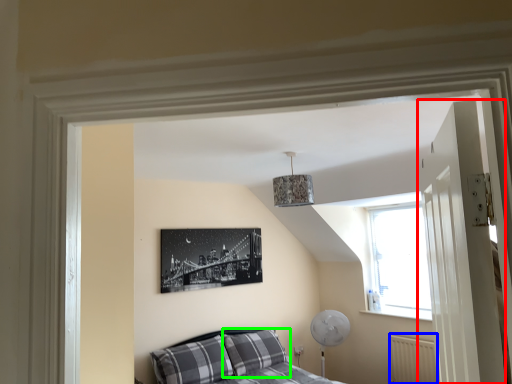
Question: Considering the real-world distances, which object is closest to door (highlighted by a red box)? radiator (highlighted by a blue box) or pillow (highlighted by a green box).

Choices:
 (A) radiator
 (B) pillow

Answer: (A)